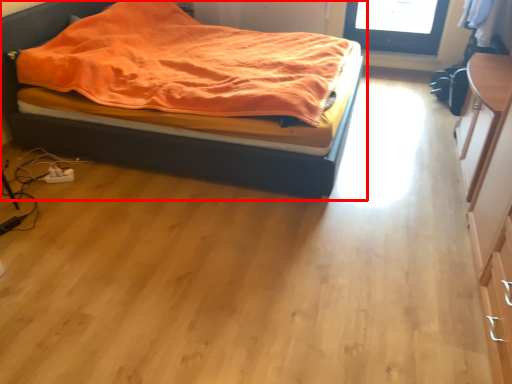
Question: From the image's perspective, what is the correct spatial positioning of bed (annotated by the red box) in reference to dresser?

Choices:
 (A) below
 (B) above

Answer: (B)